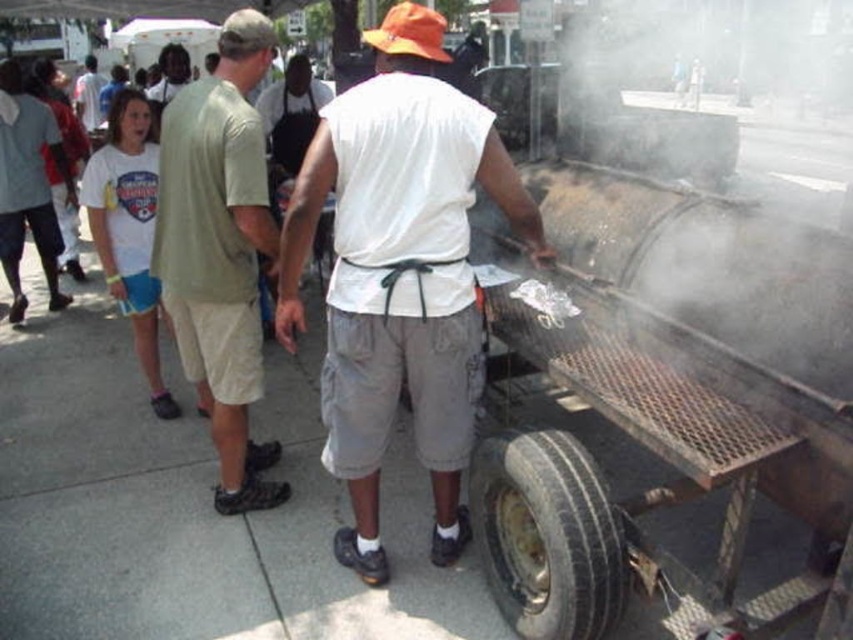
Question: Can you confirm if black rubber tire at lower right is thinner than matte black shirt at center?

Choices:
 (A) no
 (B) yes

Answer: (B)

Question: Considering the real-world distances, which object is closest to the matte black shirt at center?

Choices:
 (A) orange fabric baseball cap at upper center
 (B) light green cotton shirt at center

Answer: (A)

Question: Which point is farther from the camera taking this photo?

Choices:
 (A) (341, 435)
 (B) (91, 68)
 (C) (177, 56)

Answer: (B)

Question: Is white matte shirt at center to the right of orange fabric baseball cap at upper center from the viewer's perspective?

Choices:
 (A) no
 (B) yes

Answer: (B)

Question: Based on their relative distances, which object is nearer to the white cotton shirt at upper center?

Choices:
 (A) orange fabric baseball cap at upper center
 (B) light green cotton shirt at center

Answer: (A)

Question: Is matte black shirt at center thinner than white cotton shirt at upper center?

Choices:
 (A) no
 (B) yes

Answer: (B)